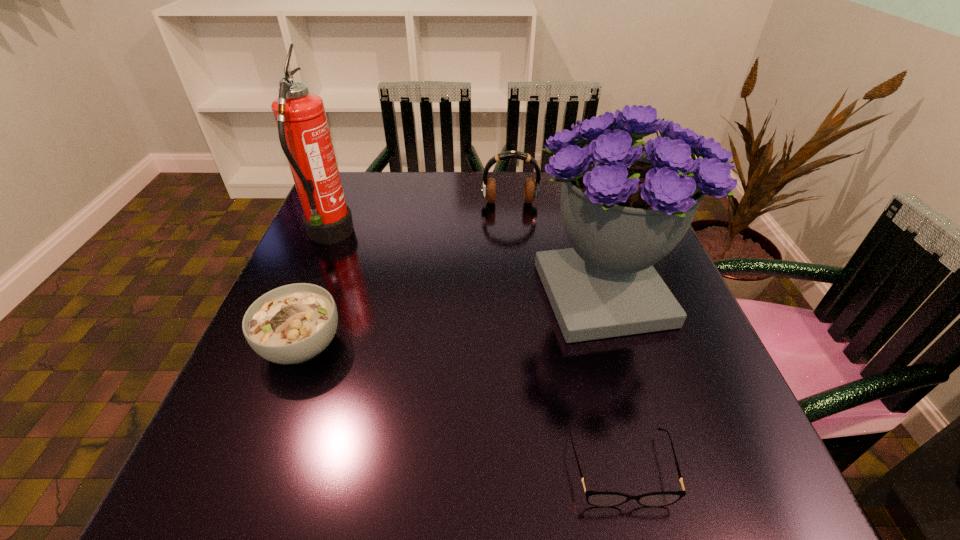
Locate an element on the screen. Image resolution: width=960 pixels, height=540 pixels. fire extinguisher is located at coordinates (304, 134).

Find the location of a particular element. The height and width of the screenshot is (540, 960). bouquet is located at coordinates (625, 205).

Find the location of `the farthest object`. the farthest object is located at coordinates (531, 188).

Find the location of `the third tallest object`. the third tallest object is located at coordinates (531, 188).

What are the coordinates of `the fourth tallest object` in the screenshot? It's located at (293, 323).

Locate an element on the screen. the nearest object is located at coordinates (600, 498).

Locate an element on the screen. spectacles is located at coordinates [600, 498].

At what (x,y) coordinates should I click in order to perform the action: click on free space located 0.300m on the front-facing side of the fire extinguisher. Please return your answer as a coordinate pair (x, y). Looking at the image, I should click on (474, 237).

You are a GUI agent. You are given a task and a screenshot of the screen. Output one action in this format:
    pyautogui.click(x=<x>, y=<y>)
    Task: Click on the vacant space located 0.310m on the left of the bouquet
    
    Given the screenshot: What is the action you would take?
    pyautogui.click(x=383, y=294)

I want to click on vacant region located on the ear cup of the farthest object, so click(512, 220).